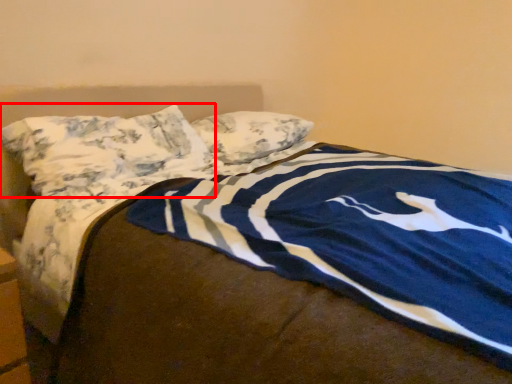
Question: From the image's perspective, where is pillow (annotated by the red box) located in relation to pillow in the image?

Choices:
 (A) above
 (B) below

Answer: (B)